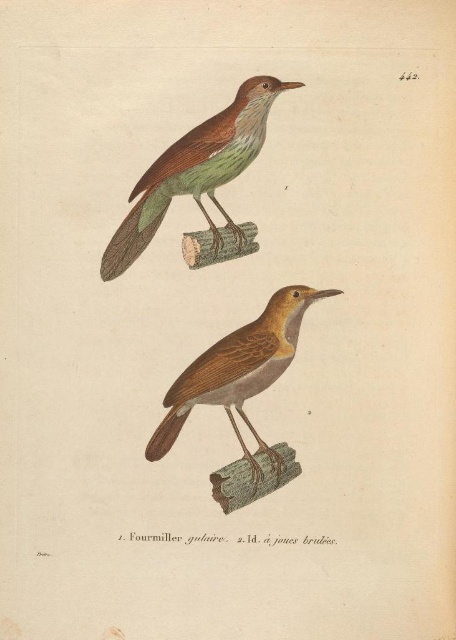
You are an ornithologist examining the illustration. You notice two points marked in the image. The first point is at coordinate (233, 225) and the second at (250, 364). Based on the illustration, which point is closer to you?

Point (233, 225) is closer to you because it is further to the viewer than point (250, 364).

You are a naturalist examining the illustration of two birds in a natural history book. The birds are labeled as matte brown bird at upper center and brown matte bird at center. Which bird is located to the left of the other?

The matte brown bird at upper center is positioned on the left side of brown matte bird at center.

Where is the matte brown bird at upper center located in the image?

The matte brown bird at upper center is located at point (196, 170).